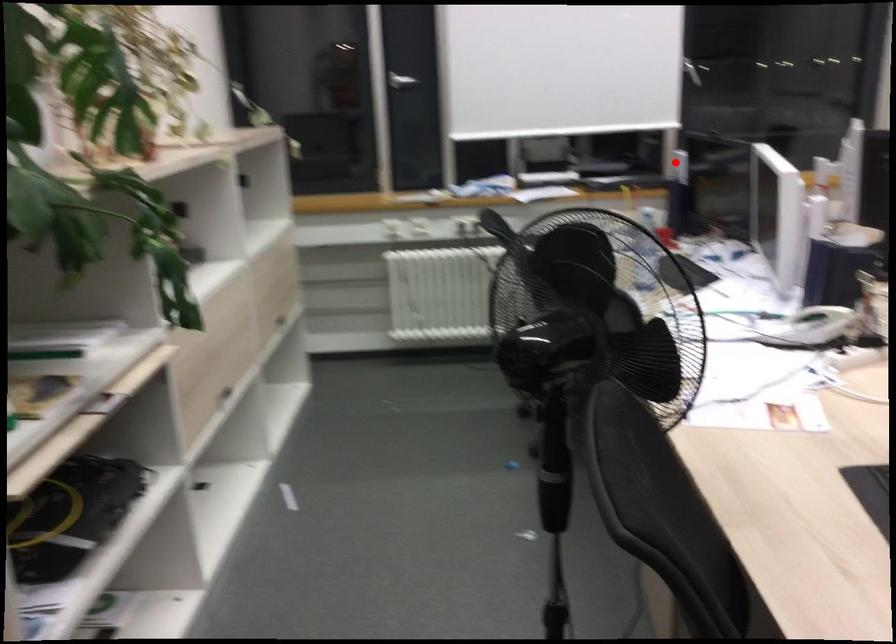
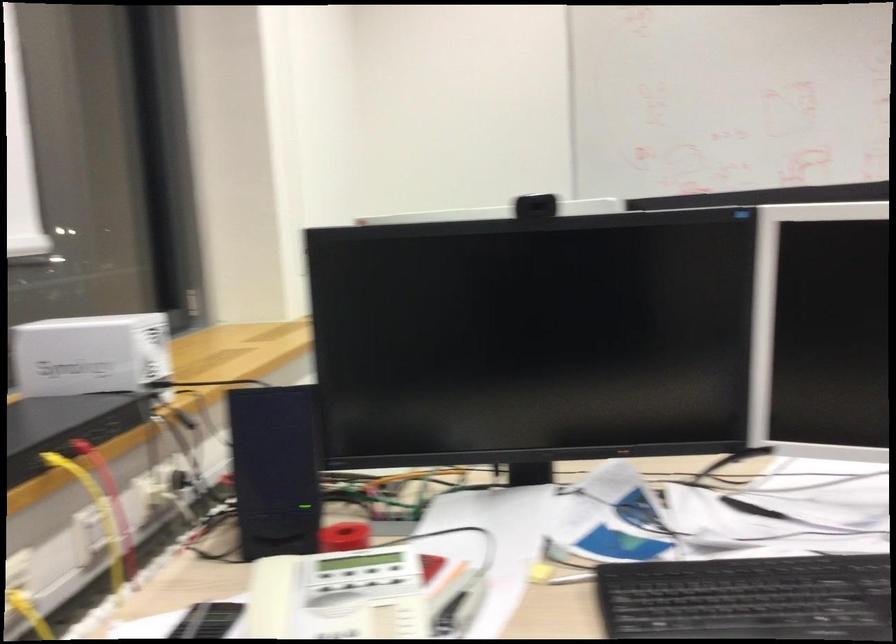
Question: I am providing you with two images of the same scene from different viewpoints. A red point is shown in image1. For the corresponding object point in image2, is it positioned nearer or farther from the camera?

Choices:
 (A) Nearer
 (B) Farther

Answer: (A)